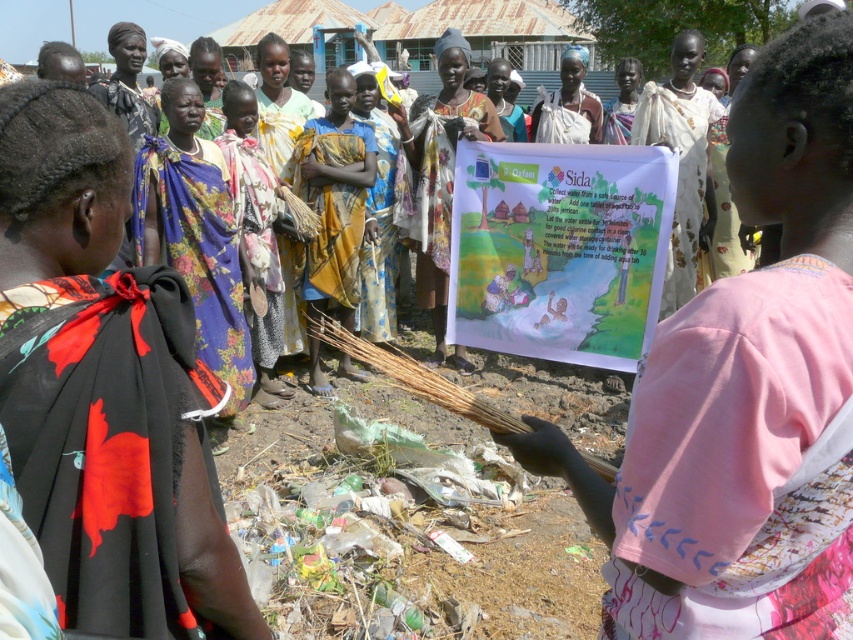
Question: Which object appears farthest from the camera in this image?

Choices:
 (A) printed fabric banner at center
 (B) white paper poster at center
 (C) brown dirt field at center

Answer: (A)

Question: Which point appears farthest from the camera in this image?

Choices:
 (A) (708, 184)
 (B) (512, 627)
 (C) (318, 365)
 (D) (24, 484)

Answer: (C)

Question: Can you confirm if brown dirt field at center is smaller than white paper poster at center?

Choices:
 (A) no
 (B) yes

Answer: (A)

Question: Which object is positioned closest to the printed fabric banner at center?

Choices:
 (A) floral fabric scarf at center
 (B) pink fabric shirt at center
 (C) printed fabric scarf at center
 (D) black floral fabric at center

Answer: (C)

Question: Observing the image, what is the correct spatial positioning of brown dirt field at center in reference to printed fabric scarf at center?

Choices:
 (A) left
 (B) right

Answer: (B)

Question: Is yellow woven cloth at center closer to the viewer compared to printed fabric banner at center?

Choices:
 (A) yes
 (B) no

Answer: (A)